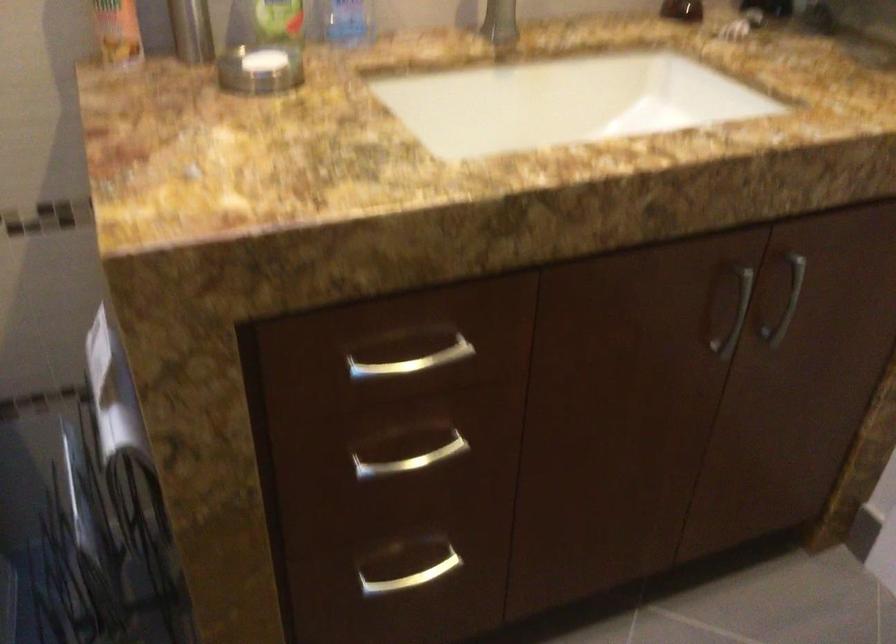
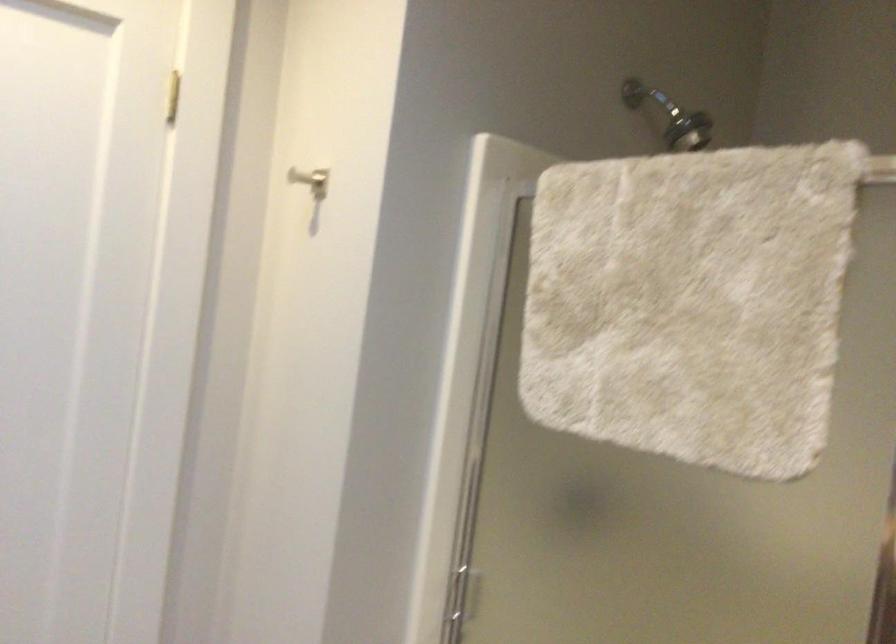
Question: The camera is either moving clockwise (left) or counter-clockwise (right) around the object. The first image is from the beginning of the video and the second image is from the end. Is the camera moving left or right when shooting the video?

Choices:
 (A) Left
 (B) Right

Answer: (A)